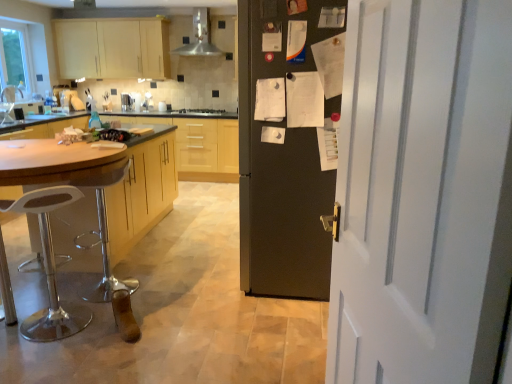
This screenshot has height=384, width=512. Identify the location of vacant area that is situated to the right of white plastic bar stool at left. (109, 331).